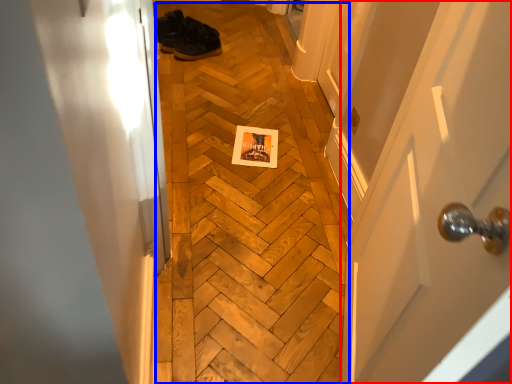
Question: Which point is further to the camera, door (highlighted by a red box) or plywood (highlighted by a blue box)?

Choices:
 (A) door
 (B) plywood

Answer: (B)